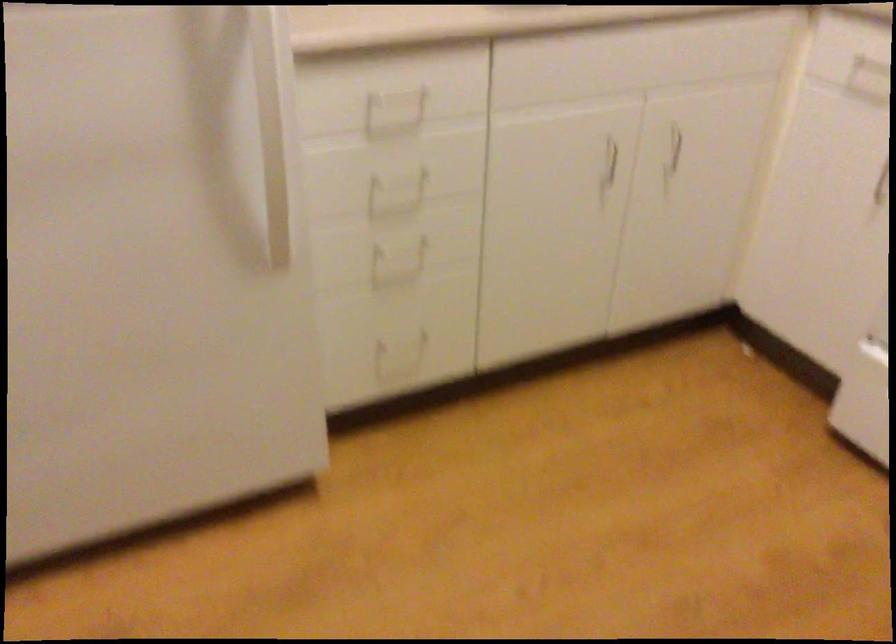
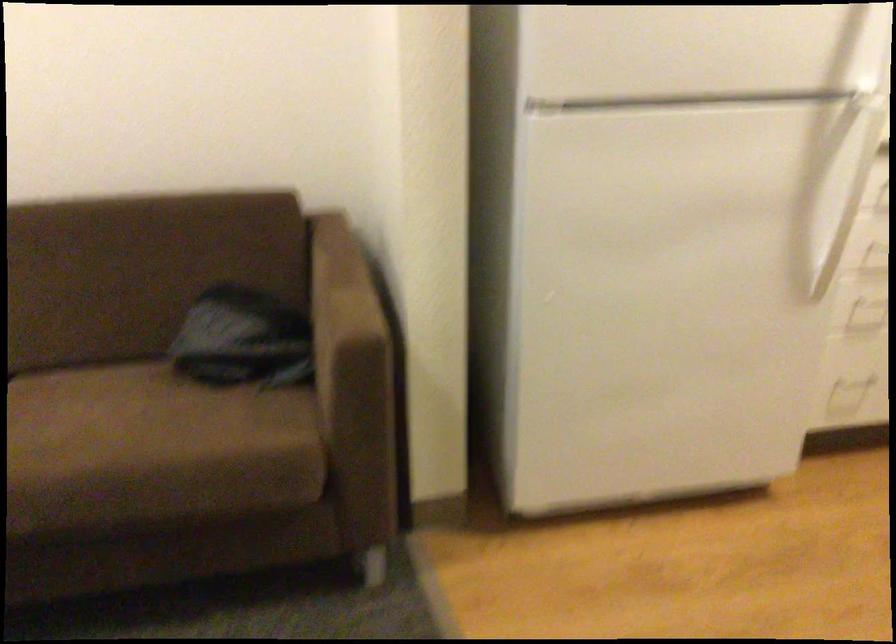
Question: How did the camera likely rotate?

Choices:
 (A) Left
 (B) Right
 (C) Up
 (D) Down

Answer: (A)